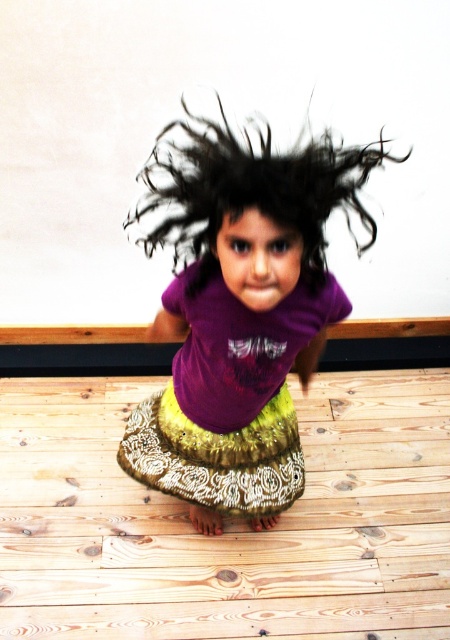
Question: Is purple matte shirt at center bigger than gold sequined skirt at center?

Choices:
 (A) no
 (B) yes

Answer: (B)

Question: Among these objects, which one is farthest from the camera?

Choices:
 (A) gold sequined skirt at center
 (B) black curly hair at center
 (C) purple matte shirt at center

Answer: (A)

Question: Is gold sequined skirt at center thinner than black curly hair at center?

Choices:
 (A) yes
 (B) no

Answer: (B)

Question: Which point is closer to the camera taking this photo?

Choices:
 (A) (318, 164)
 (B) (323, 230)
 (C) (212, 461)

Answer: (A)

Question: Which is farther from the black curly hair at center?

Choices:
 (A) gold sequined skirt at center
 (B) purple matte shirt at center

Answer: (A)

Question: Does purple matte shirt at center have a lesser width compared to black curly hair at center?

Choices:
 (A) yes
 (B) no

Answer: (B)